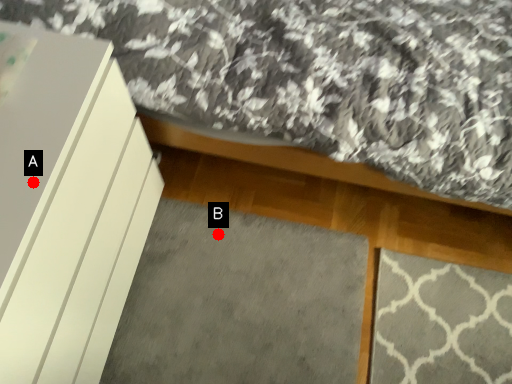
Question: Two points are circled on the image, labeled by A and B beside each circle. Which point is farther from the camera taking this photo?

Choices:
 (A) A is further
 (B) B is further

Answer: (B)